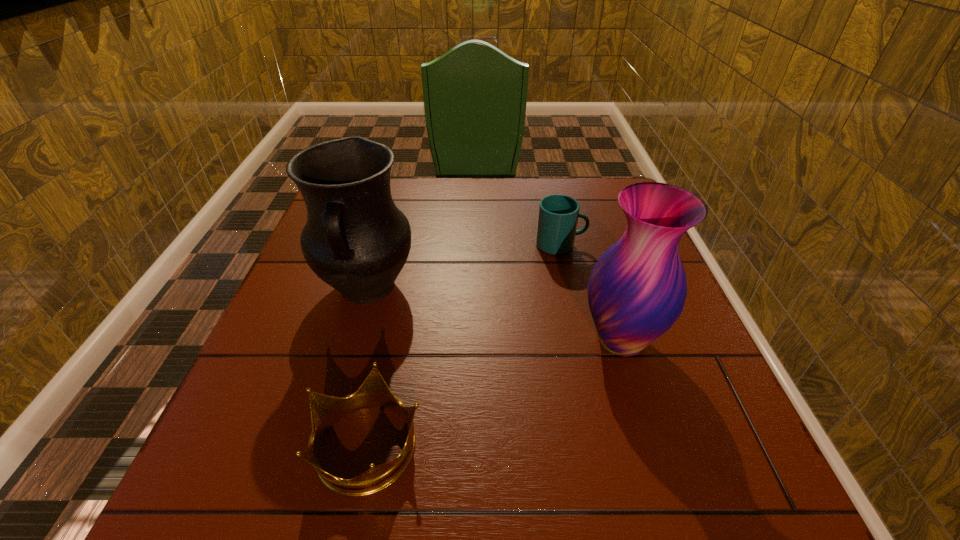
The image size is (960, 540). What are the coordinates of `object at the left edge` in the screenshot? It's located at (355, 239).

At what (x,y) coordinates should I click in order to perform the action: click on object situated at the right edge. Please return your answer as a coordinate pair (x, y). The width and height of the screenshot is (960, 540). Looking at the image, I should click on pos(637,289).

The height and width of the screenshot is (540, 960). Identify the location of vacant area at the far edge. (441, 198).

Find the location of a particular element. free location at the near edge of the desktop is located at coordinates (616, 498).

In the image, there is a desktop. Where is `free space at the left edge`? The image size is (960, 540). free space at the left edge is located at coordinates (293, 374).

At what (x,y) coordinates should I click in order to perform the action: click on vacant space at the right edge of the desktop. Please return your answer as a coordinate pair (x, y). Image resolution: width=960 pixels, height=540 pixels. Looking at the image, I should click on (680, 351).

The width and height of the screenshot is (960, 540). What are the coordinates of `vacant space at the far right corner of the desktop` in the screenshot? It's located at click(618, 188).

Find the location of a particular element. vacant area that lies between the pitcher and the cup is located at coordinates (464, 266).

The width and height of the screenshot is (960, 540). I want to click on vacant area that lies between the vase and the pitcher, so click(x=493, y=314).

Find the location of a particular element. vacant point located between the pitcher and the nearest object is located at coordinates (368, 366).